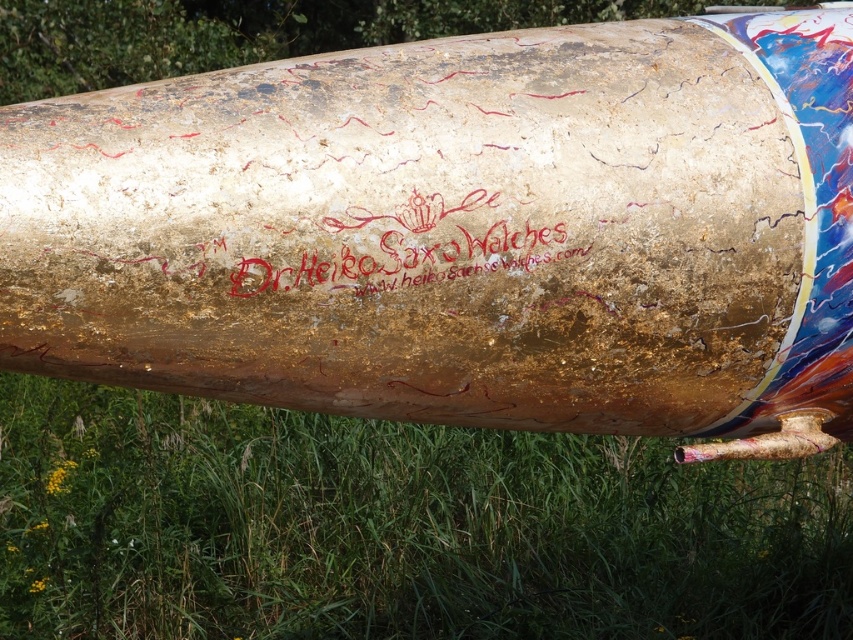
You are a photographer trying to capture the gold metallic barrel at center and the green grass at lower center in the same frame. Since the barrel is thinner than the grass, which object should you position closer to the camera to ensure both fit within the frame?

The gold metallic barrel at center is thinner than the green grass at lower center, so you should position the gold metallic barrel at center closer to the camera to ensure both fit within the frame.

You are standing at the edge of a field and see the gold metallic barrel at center and the green grass at lower center. If you want to place a 6 feet long ladder between them, will there be enough space? Please explain your reasoning.

The gold metallic barrel at center and green grass at lower center are 5.00 feet apart. Since the ladder is 6 feet long, it would not fit between them as the distance is shorter than the ladder.

You are a photographer trying to capture the gold metallic barrel at center and the green grass at lower center in a single frame. Based on their sizes, which object should you focus on first to ensure both are in the frame?

The gold metallic barrel at center is smaller than the green grass at lower center, so you should focus on the gold metallic barrel at center first to ensure it is in focus while the larger green grass at lower center will naturally be within the frame.